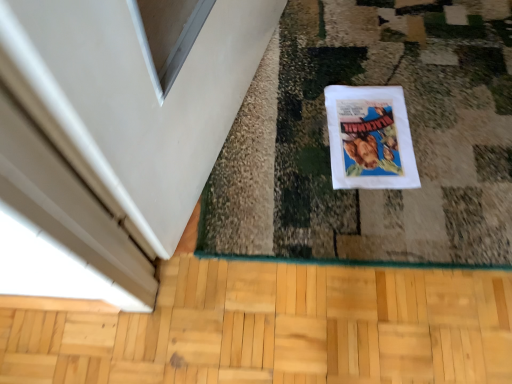
At what (x,y) coordinates should I click in order to perform the action: click on free location above white paper comic book at center (from a real-world perspective). Please return your answer as a coordinate pair (x, y). This screenshot has height=384, width=512. Looking at the image, I should click on (374, 137).